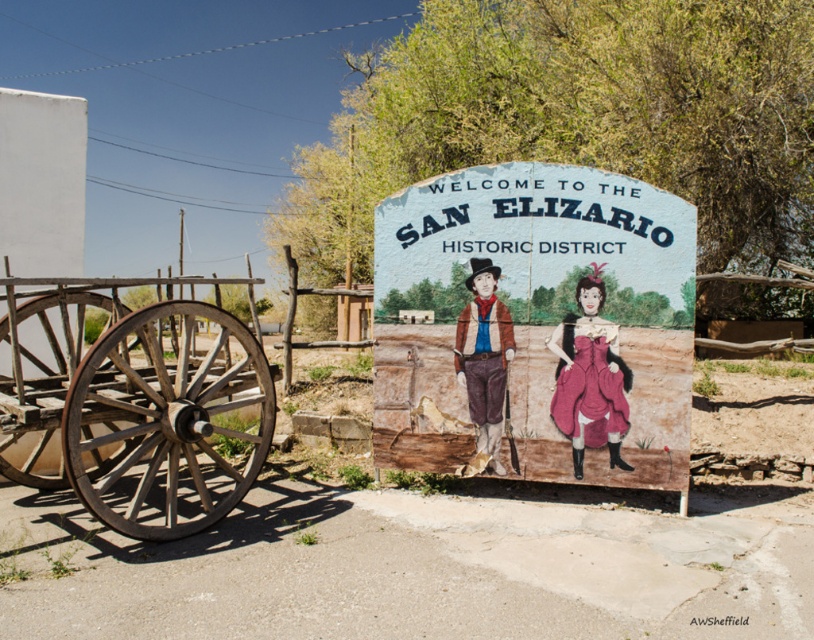
Can you confirm if rustic wooden sign at center is positioned to the left of wooden wagon wheel at left?

In fact, rustic wooden sign at center is to the right of wooden wagon wheel at left.

Does point (537, 429) come farther from viewer compared to point (38, 420)?

Yes, point (537, 429) is farther from viewer.

Identify the location of rustic wooden sign at center. The height and width of the screenshot is (640, 814). (535, 324).